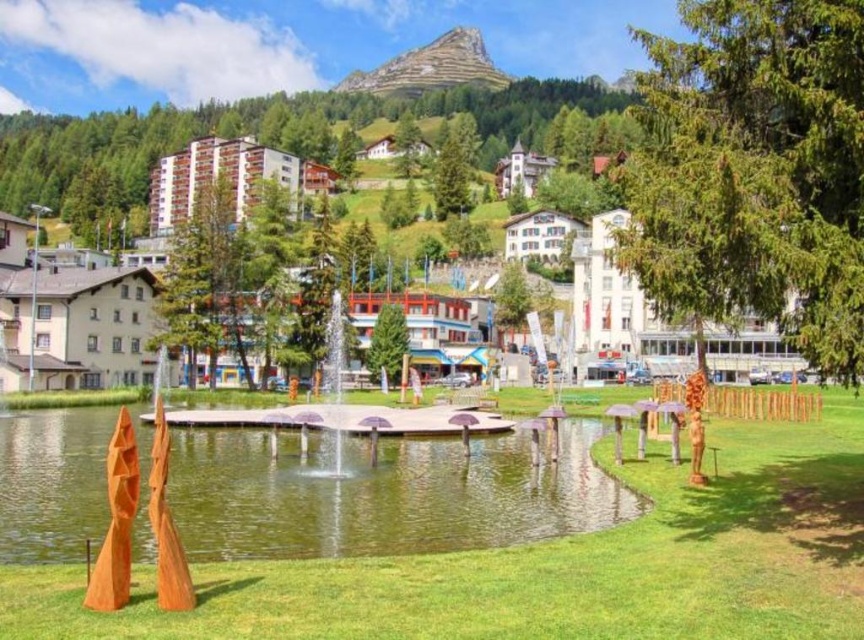
Is point (845, 291) positioned after point (392, 376)?

No, (845, 291) is in front of (392, 376).

Can you confirm if green coniferous tree at right is thinner than green matte tree at center?

No.

Identify the location of green coniferous tree at right. (756, 172).

Measure the distance between green coniferous tree at right and green matte tree at upper center.

They are 139.56 meters apart.

Between green coniferous tree at right and green matte tree at upper center, which one appears on the left side from the viewer's perspective?

green matte tree at upper center is more to the left.

Is point (702, 76) closer to viewer compared to point (436, 198)?

Yes.

The width and height of the screenshot is (864, 640). In order to click on green coniferous tree at right in this screenshot , I will do pos(756,172).

Which is above, green water at center or matte wooden sculptures at center?

Positioned higher is matte wooden sculptures at center.

Where is `green water at center`? green water at center is located at coordinates (382, 493).

Locate an element on the screen. This screenshot has height=640, width=864. green water at center is located at coordinates (382, 493).